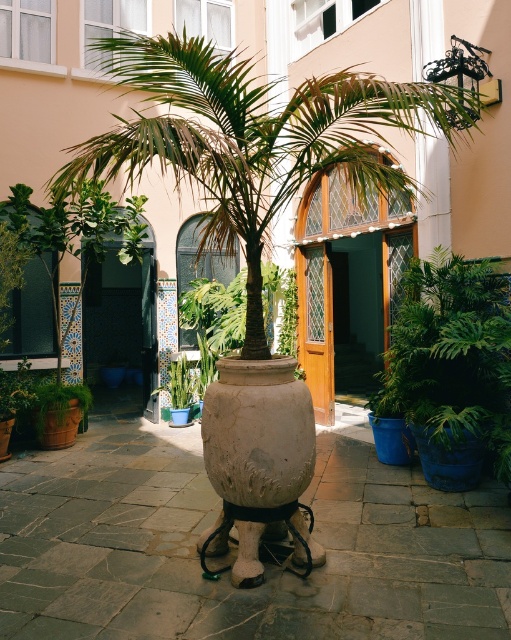
You are a gardener who needs to water both the green leafy palm tree at center and the white textured vase at center. The watering can you have can only hold enough water for one of them. Based on their distance apart, which one should you water first to minimize walking distance back to the water source located at the entrance?

The green leafy palm tree at center and white textured vase at center are 4.77 feet apart from each other. Since the distance between them is fixed, you should water whichever is closer to the entrance first to minimize walking distance. However, the exact position of the entrance isn not provided in the scene description, so you may need to assess their positions relative to the entrance visually.

You are a gardener who wants to ensure the green leafy palm tree at center and the white textured vase at center are visible from the entrance. Considering their sizes, which one might block the view of the other?

The green leafy palm tree at center is much taller than the white textured vase at center, so it might block the view of the white textured vase at center from the entrance.

You are a gardener who needs to water the green leafy palm tree at center and the white textured vase at center. Since both are at the center, which one should you water first if you want to avoid getting the vase wet from the palm tree?

The green leafy palm tree at center is positioned over the white textured vase at center, so you should water the white textured vase at center first to avoid water dripping from the palm tree onto it.